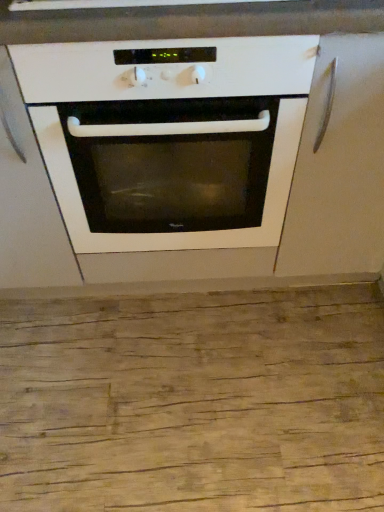
Question: Should I look upward or downward to see matte white cabinet at right, the first cabinetry from the right?

Choices:
 (A) up
 (B) down

Answer: (A)

Question: From the image's perspective, is matte white cabinet at right, the first cabinetry from the right, located beneath white glossy oven at center?

Choices:
 (A) yes
 (B) no

Answer: (B)

Question: Does matte white cabinet at right, the first cabinetry from the right, have a greater width compared to white glossy oven at center?

Choices:
 (A) yes
 (B) no

Answer: (A)

Question: Considering the relative sizes of matte white cabinet at right, the first cabinetry from the right, and white glossy oven at center in the image provided, is matte white cabinet at right, the first cabinetry from the right, thinner than white glossy oven at center?

Choices:
 (A) no
 (B) yes

Answer: (A)

Question: From a real-world perspective, is matte white cabinet at right, the first cabinetry from the right, on white glossy oven at center?

Choices:
 (A) no
 (B) yes

Answer: (B)

Question: Does matte white cabinet at right, the first cabinetry from the right, have a larger size compared to white glossy oven at center?

Choices:
 (A) yes
 (B) no

Answer: (B)

Question: From the image's perspective, does matte white cabinet at right, the first cabinetry from the right, appear higher than white glossy oven at center?

Choices:
 (A) no
 (B) yes

Answer: (B)

Question: From a real-world perspective, is white matte cabinet at center, arranged as the 2th cabinetry when viewed from the right, beneath matte white cabinet at right, which is the second cabinetry in left-to-right order?

Choices:
 (A) no
 (B) yes

Answer: (B)

Question: Is white matte cabinet at center, the first cabinetry from the left, next to matte white cabinet at right, the first cabinetry from the right?

Choices:
 (A) no
 (B) yes

Answer: (A)

Question: Is matte white cabinet at right, the first cabinetry from the right, located within white matte cabinet at center, arranged as the 2th cabinetry when viewed from the right?

Choices:
 (A) yes
 (B) no

Answer: (B)

Question: Is white matte cabinet at center, arranged as the 2th cabinetry when viewed from the right, completely or partially outside of matte white cabinet at right, the first cabinetry from the right?

Choices:
 (A) yes
 (B) no

Answer: (A)

Question: From the image's perspective, does white matte cabinet at center, arranged as the 2th cabinetry when viewed from the right, appear lower than matte white cabinet at right, which is the second cabinetry in left-to-right order?

Choices:
 (A) no
 (B) yes

Answer: (B)

Question: From the image's perspective, is white matte cabinet at center, arranged as the 2th cabinetry when viewed from the right, above matte white cabinet at right, the first cabinetry from the right?

Choices:
 (A) no
 (B) yes

Answer: (A)

Question: Considering the relative positions of white glossy oven at center and matte white cabinet at right, which is the second cabinetry in left-to-right order, in the image provided, is white glossy oven at center to the right of matte white cabinet at right, which is the second cabinetry in left-to-right order, from the viewer's perspective?

Choices:
 (A) yes
 (B) no

Answer: (B)